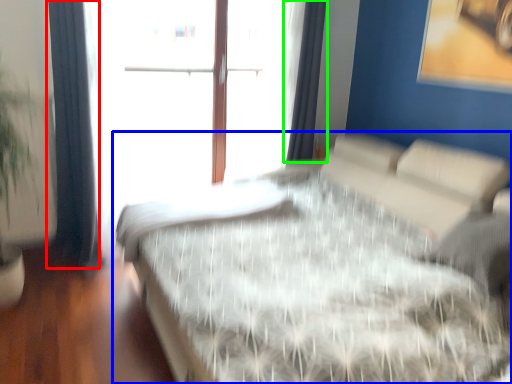
Question: Considering the real-world distances, which object is farthest from curtain (highlighted by a red box)? bed (highlighted by a blue box) or curtain (highlighted by a green box)?

Choices:
 (A) bed
 (B) curtain

Answer: (B)